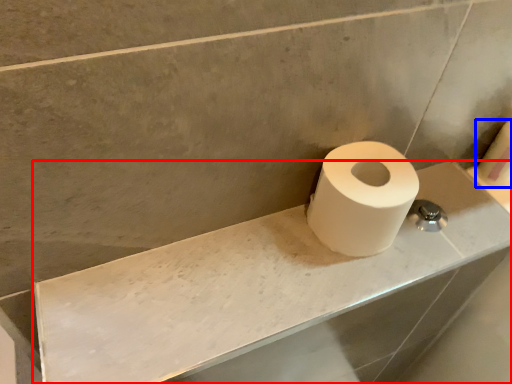
Question: Among these objects, which one is farthest to the camera, counter top (highlighted by a red box) or toilet paper (highlighted by a blue box)?

Choices:
 (A) counter top
 (B) toilet paper

Answer: (B)